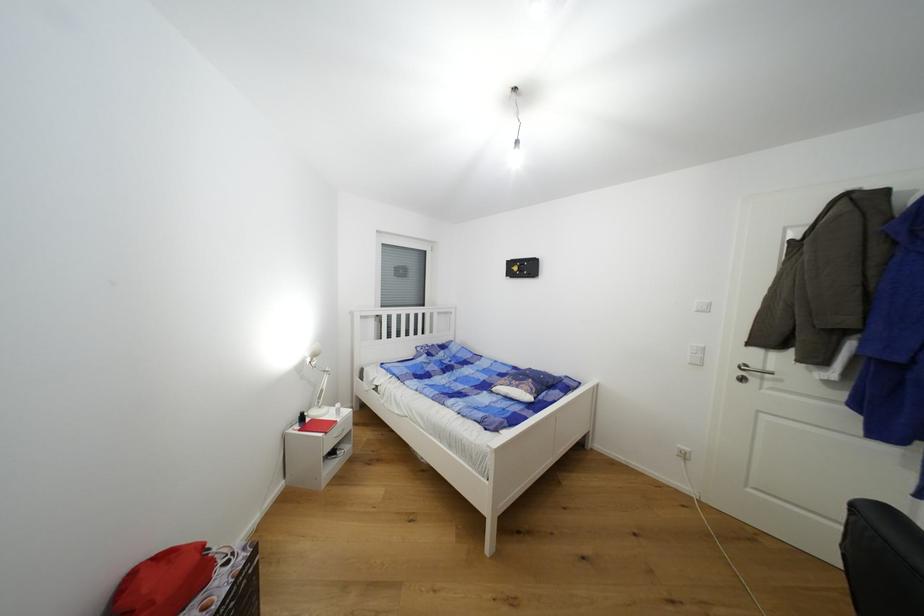
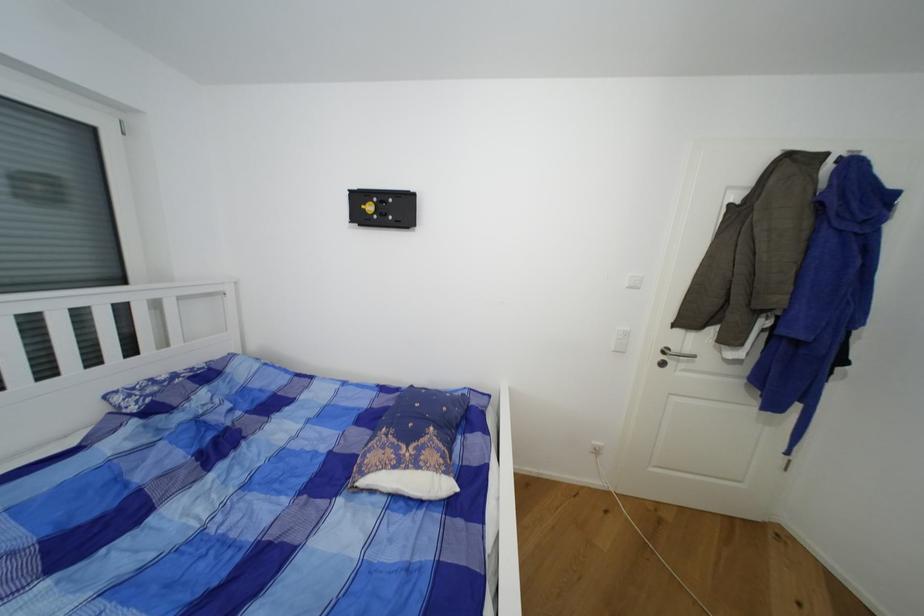
The point at (774,371) is marked in the first image. Where is the corresponding point in the second image?

(691, 352)